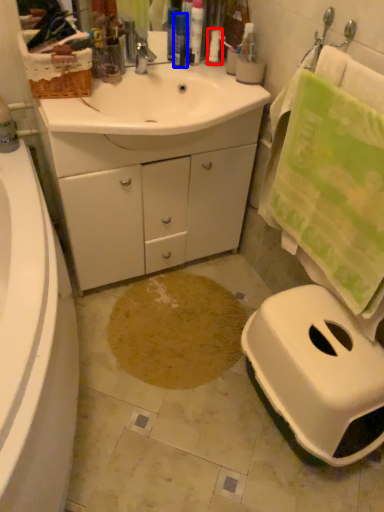
Question: Among these objects, which one is nearest to the camera, toiletry (highlighted by a red box) or toiletry (highlighted by a blue box)?

Choices:
 (A) toiletry
 (B) toiletry

Answer: (B)